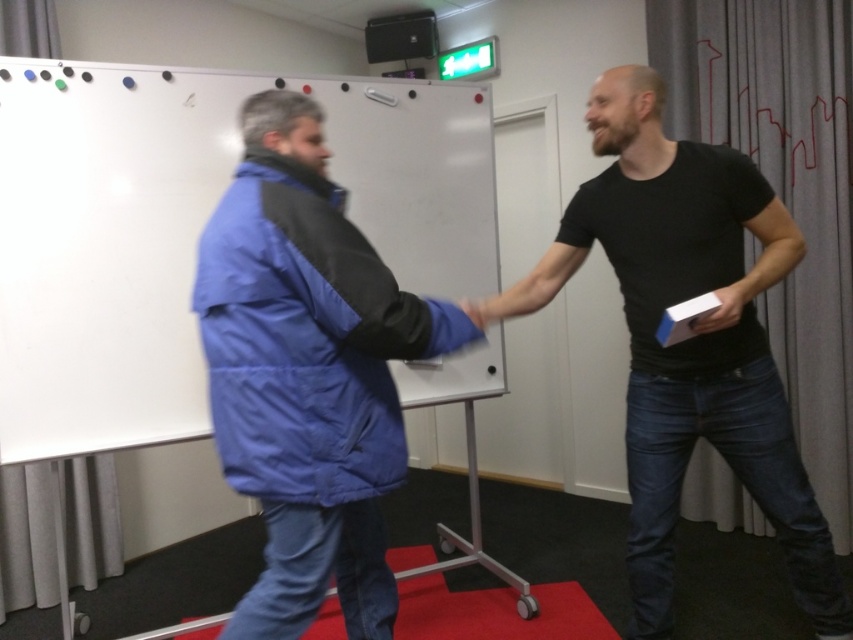
Question: Is white matte board at center smaller than blue puffy jacket at center?

Choices:
 (A) yes
 (B) no

Answer: (B)

Question: Is blue puffy jacket at center wider than black matte shirt at center?

Choices:
 (A) yes
 (B) no

Answer: (B)

Question: Which is farther from the matte black hand at center?

Choices:
 (A) blue puffy jacket at center
 (B) black matte shirt at center
 (C) white matte board at center

Answer: (C)

Question: Does white matte board at center appear on the right side of matte black hand at center?

Choices:
 (A) no
 (B) yes

Answer: (A)

Question: Which object is farther from the camera taking this photo?

Choices:
 (A) matte black hand at center
 (B) white matte board at center
 (C) blue puffy jacket at center

Answer: (B)

Question: Which is farther from the matte black hand at center?

Choices:
 (A) black matte shirt at center
 (B) white matte board at center
 (C) blue puffy jacket at center

Answer: (B)